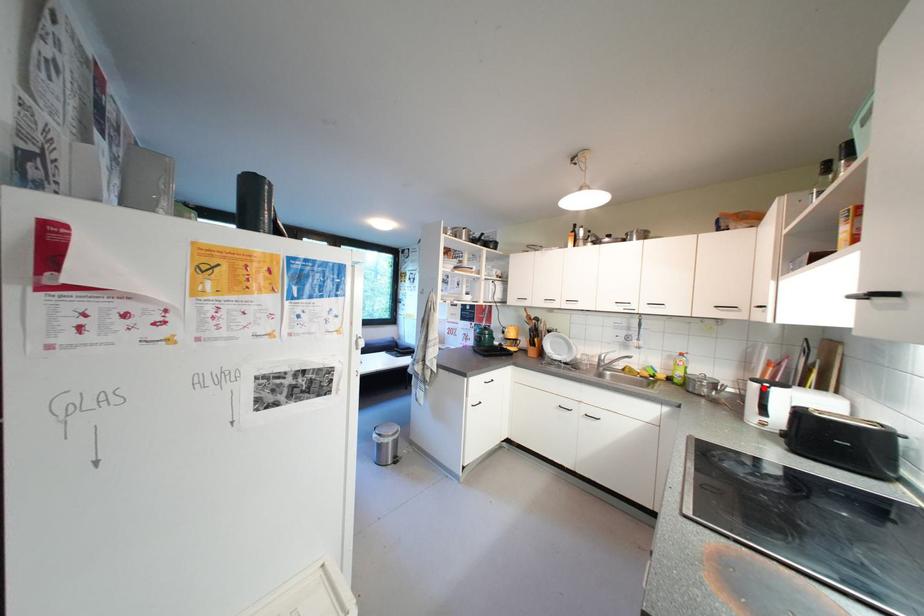
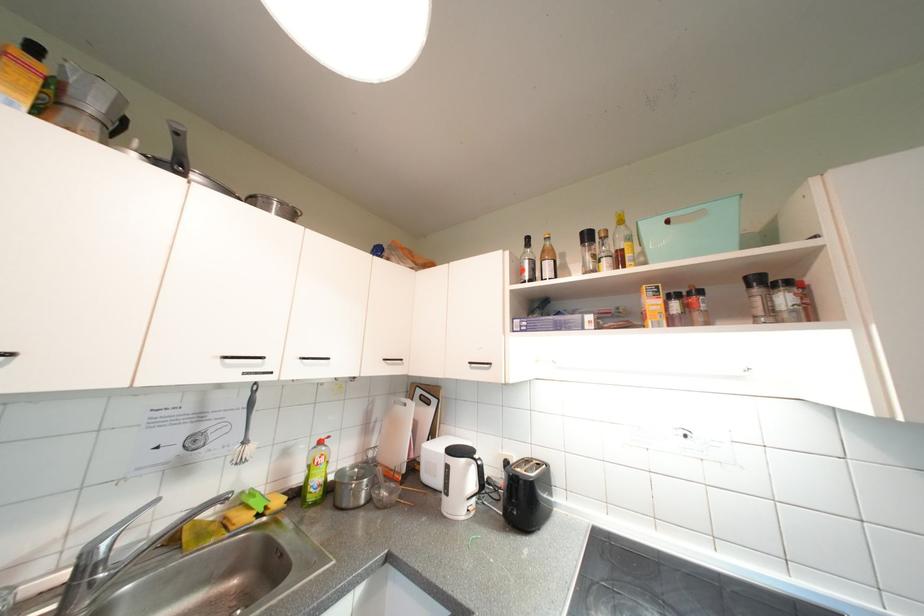
Where in the second image is the point corresponding to the highlighted location from the first image?

(477, 466)